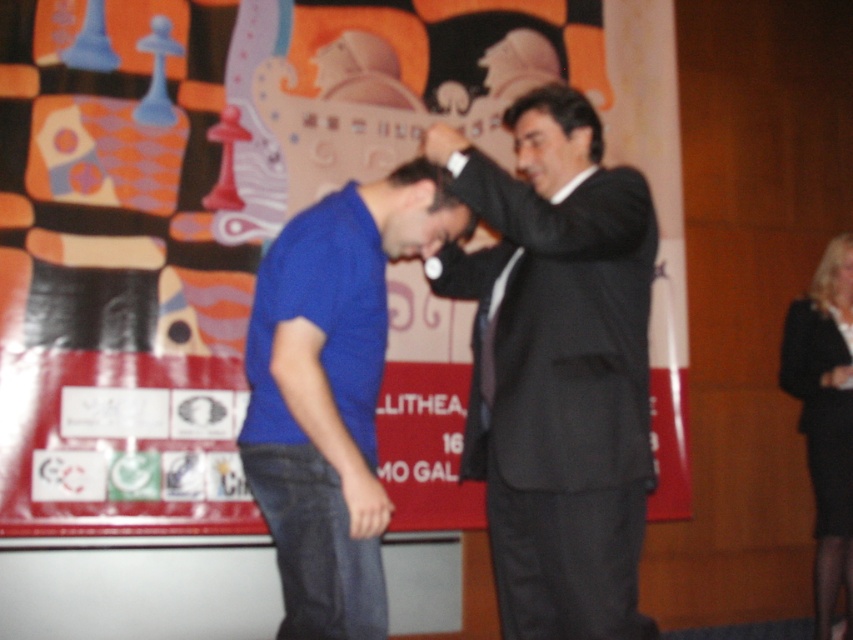
You are observing the scene from the front. There are two points marked in the image. The first point is at coordinate point (412,131) and the second is at point (332,448). Which point is closer to you?

Point (332,448) is closer to you because it is in front of point (412,131).

You are a photographer setting up for a photoshoot. You need to ensure that the matte plastic chess piece at upper left and the blue cotton shirt at center are both visible in the frame. Given their sizes, which object will require you to adjust your camera angle more to include it in the shot?

The matte plastic chess piece at upper left is much taller than the blue cotton shirt at center, so you will need to adjust your camera angle more to include the matte plastic chess piece at upper left in the frame.

You are a photographer setting up for a photoshoot. You notice two items in the scene that need to be positioned properly for the shoot. The black suit at center and the black fabric skirt at lower right. Based on their current positions, which item is closer to the left side of the image?

The black suit at center is to the left of the black fabric skirt at lower right, so the black suit at center is closer to the left side of the image.